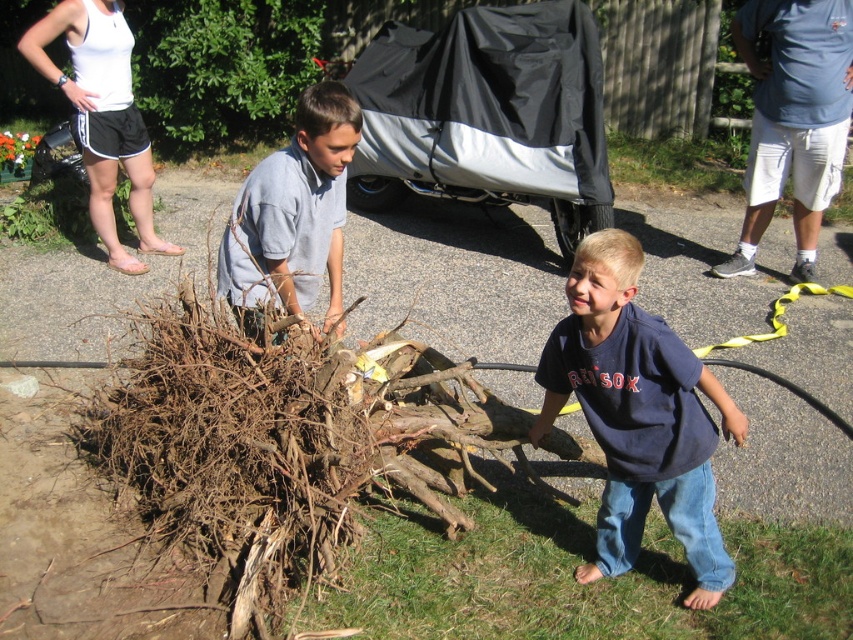
Does point (662, 436) lie behind point (331, 305)?

No, it is not.

Between blue cotton shirt at center and gray cotton shirt at center, which one has less height?

Standing shorter between the two is gray cotton shirt at center.

What do you see at coordinates (637, 413) in the screenshot? The width and height of the screenshot is (853, 640). I see `blue cotton shirt at center` at bounding box center [637, 413].

Identify the location of blue cotton shirt at center. This screenshot has height=640, width=853. (637, 413).